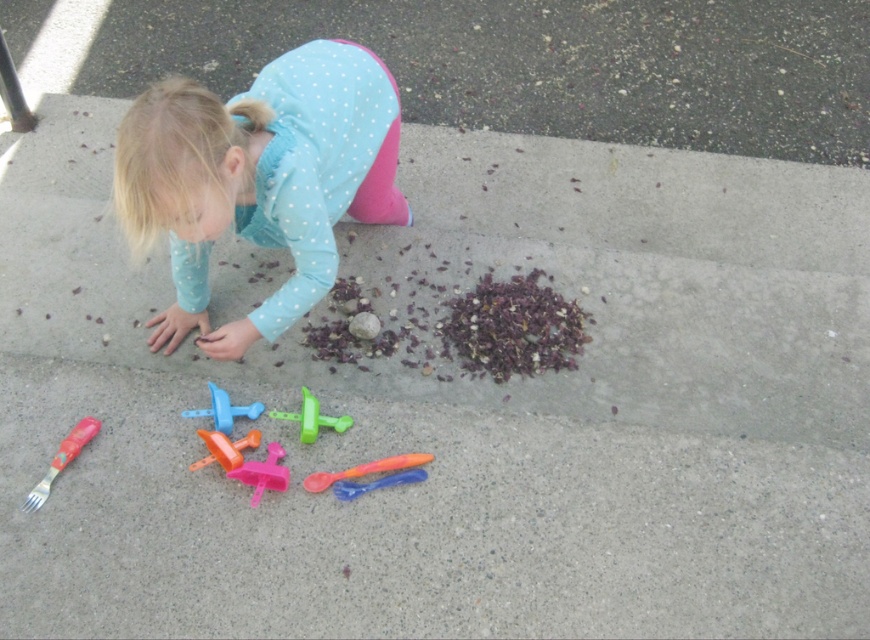
You are a parent trying to locate your child who is playing outside. You see the blue dotted shirt at center and the pink plastic toy at lower center. Which object is to the left of the other?

The pink plastic toy at lower center is to the left of the blue dotted shirt at center because the blue dotted shirt at center is positioned on the right side of pink plastic toy at lower center.

You are a child trying to pick up the orange plastic spoon at lower center and the translucent orange plastic toy at center. Which one can you reach first without moving your feet?

The orange plastic spoon at lower center is closer to the viewer than the translucent orange plastic toy at center, so you can reach it first without moving your feet.

You are a robot trying to pick up the orange plastic spoon at lower center. What is the exact 2D coordinate point where you should move your robotic arm to retrieve it?

The orange plastic spoon at lower center is located at the 2D coordinate point of (365,468).